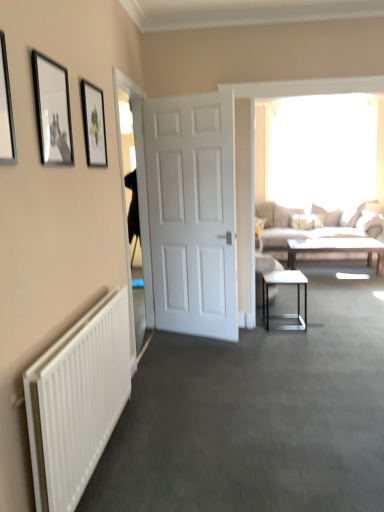
Question: Is black matte picture frame at upper left, positioned as the second picture frame in back-to-front order, taller or shorter than transparent glass window at upper center?

Choices:
 (A) short
 (B) tall

Answer: (A)

Question: Considering the positions of point (x=39, y=108) and point (x=331, y=181), is point (x=39, y=108) closer or farther from the camera than point (x=331, y=181)?

Choices:
 (A) closer
 (B) farther

Answer: (A)

Question: Estimate the real-world distances between objects in this image. Which object is farther from the metallic black side table at center?

Choices:
 (A) white matte door at center
 (B) black matte picture frame at upper left, which is the 2th picture frame in front-to-back order
 (C) metallic silver picture frame at upper left, the 3th picture frame viewed from the right
 (D) transparent glass window at upper center
 (E) light brown wooden coffee table at center

Answer: (D)

Question: Which of these objects is positioned closest to the matte black picture frame at upper left, which ranks as the 1th picture frame in right-to-left order?

Choices:
 (A) metallic silver picture frame at upper left, the 3th picture frame viewed from the right
 (B) beige fabric couch at right
 (C) white matte door at center
 (D) transparent glass window at upper center
 (E) transparent glass door at left

Answer: (E)